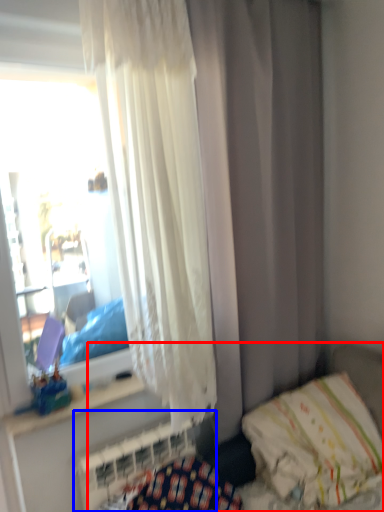
Question: Among these objects, which one is nearest to the camera, hospital bed (highlighted by a red box) or radiator (highlighted by a blue box)?

Choices:
 (A) hospital bed
 (B) radiator

Answer: (A)